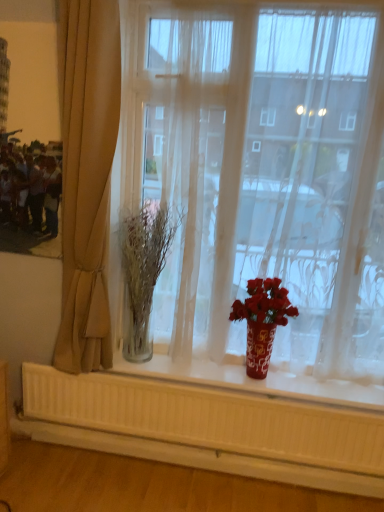
Question: Based on their sizes in the image, would you say shiny red vase at center is bigger or smaller than beige fabric curtain at left?

Choices:
 (A) small
 (B) big

Answer: (A)

Question: Does point (251, 334) appear closer or farther from the camera than point (96, 338)?

Choices:
 (A) closer
 (B) farther

Answer: (B)

Question: Which of these objects is positioned closest to the shiny red vase at center?

Choices:
 (A) clear glass vase at center
 (B) transparent glass vase at center
 (C) beige fabric curtain at left

Answer: (B)

Question: Which is nearer to the shiny red vase at center?

Choices:
 (A) transparent glass vase at center
 (B) clear glass vase at center
 (C) beige fabric curtain at left

Answer: (A)